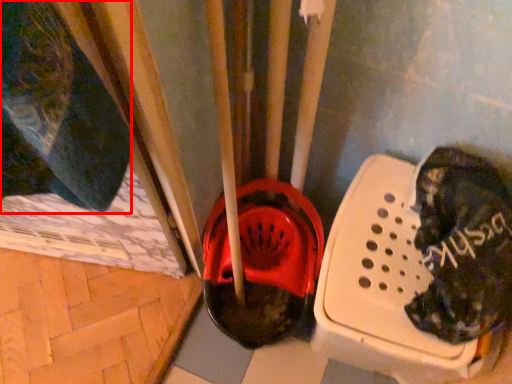
Question: From the image, what is the correct spatial relationship of clothing (annotated by the red box) in relation to footwear?

Choices:
 (A) left
 (B) right

Answer: (A)